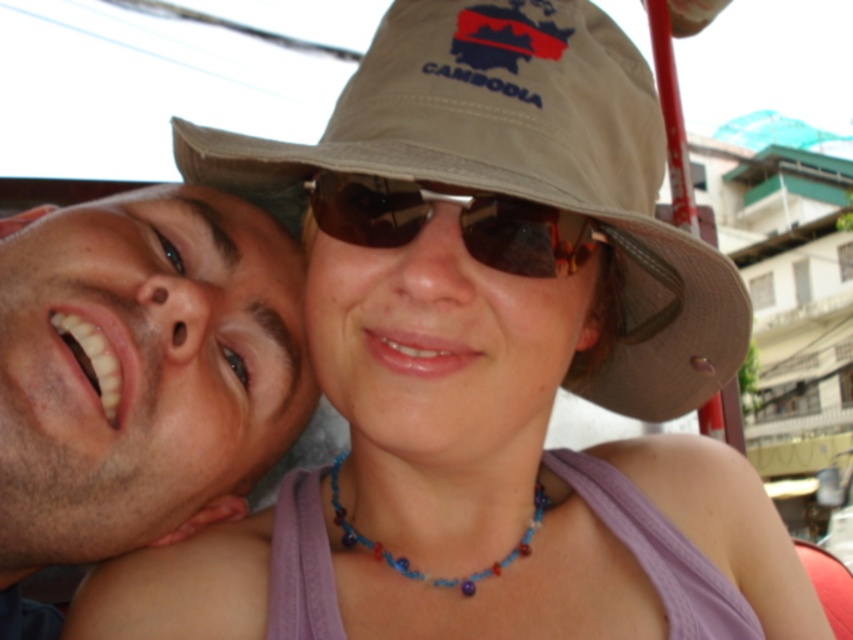
Question: Does khaki fabric hat at center have a lesser width compared to matte brown hat at center?

Choices:
 (A) no
 (B) yes

Answer: (A)

Question: Which point is farther to the camera?

Choices:
 (A) brown reflective sunglasses at center
 (B) khaki fabric hat at center
 (C) matte brown hat at center

Answer: (A)

Question: Is matte skin face at left to the right of brown reflective sunglasses at center from the viewer's perspective?

Choices:
 (A) no
 (B) yes

Answer: (A)

Question: Among these objects, which one is farthest from the camera?

Choices:
 (A) matte brown hat at center
 (B) khaki fabric hat at center
 (C) matte skin face at left
 (D) brown reflective sunglasses at center

Answer: (C)

Question: Can you confirm if khaki fabric hat at center is positioned to the right of matte brown hat at center?

Choices:
 (A) no
 (B) yes

Answer: (B)

Question: Which point is farther to the camera?

Choices:
 (A) matte brown hat at center
 (B) khaki fabric hat at center
 (C) matte skin face at left

Answer: (C)